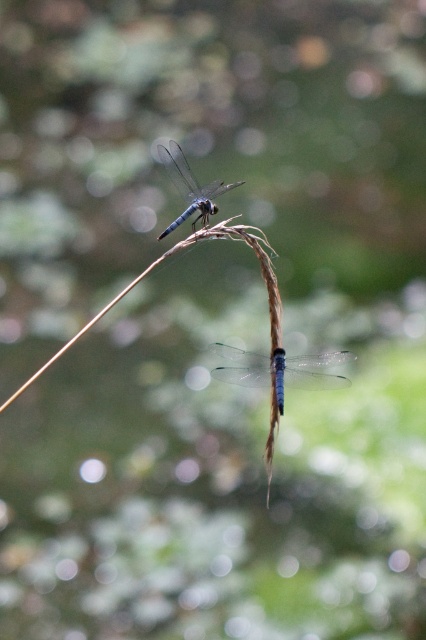
Who is taller, transparent blue dragonfly at center or blue translucent dragonfly at upper center?

blue translucent dragonfly at upper center

How far apart are transparent blue dragonfly at center and blue translucent dragonfly at upper center?

transparent blue dragonfly at center is 15.53 inches away from blue translucent dragonfly at upper center.

Who is more distant from viewer, (236, 348) or (204, 212)?

Positioned behind is point (204, 212).

Locate an element on the screen. This screenshot has height=640, width=426. transparent blue dragonfly at center is located at coordinates (279, 369).